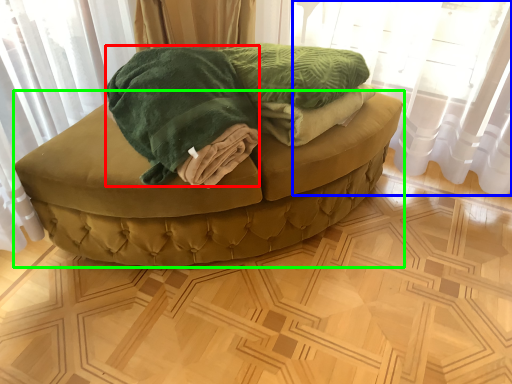
Question: Estimate the real-world distances between objects in this image. Which object is farther from cloth (highlighted by a red box), curtain (highlighted by a blue box) or furniture (highlighted by a green box)?

Choices:
 (A) curtain
 (B) furniture

Answer: (A)